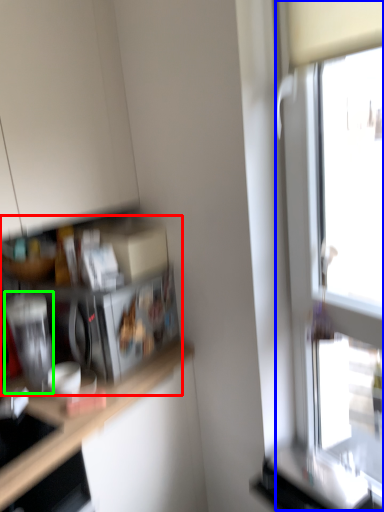
Question: Based on their relative distances, which object is farther from shelf (highlighted by a red box)? Choose from window (highlighted by a blue box) and appliance (highlighted by a green box).

Choices:
 (A) window
 (B) appliance

Answer: (A)